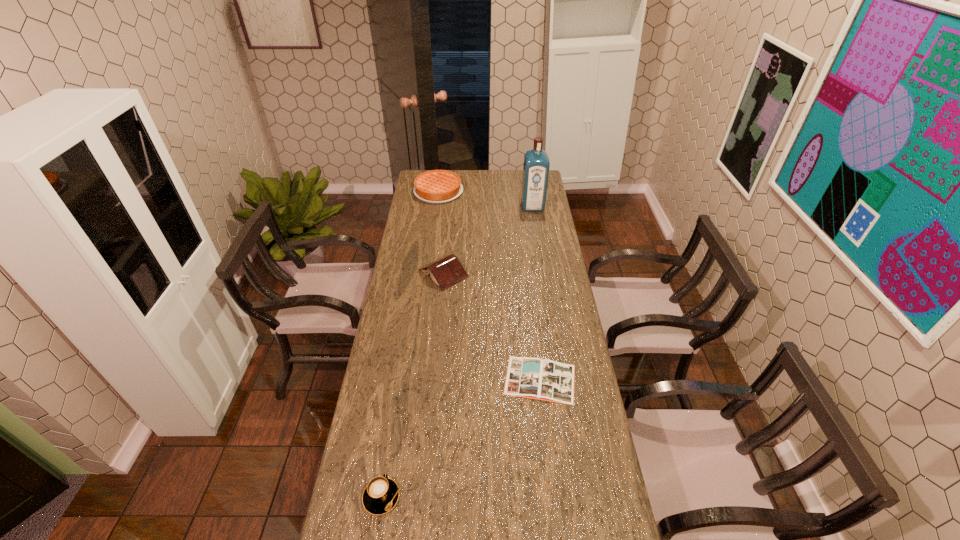
Where is `vacant position located 0.130m on the back of the fifth farthest object`? vacant position located 0.130m on the back of the fifth farthest object is located at coordinates (392, 436).

Find the location of a particular element. vacant space situated on the left of the shortest book is located at coordinates (398, 380).

This screenshot has height=540, width=960. I want to click on object positioned at the far edge, so click(436, 186).

Find the location of a particular element. This screenshot has width=960, height=540. pie at the left edge is located at coordinates (436, 186).

Locate an element on the screen. The width and height of the screenshot is (960, 540). book that is at the left edge is located at coordinates (446, 271).

This screenshot has width=960, height=540. Identify the location of cappuccino present at the left edge. (380, 496).

Locate an element on the screen. The image size is (960, 540). liquor located in the right edge section of the desktop is located at coordinates (536, 166).

This screenshot has width=960, height=540. I want to click on book that is positioned at the right edge, so click(x=548, y=380).

You are a GUI agent. You are given a task and a screenshot of the screen. Output one action in this format:
    pyautogui.click(x=<x>, y=<y>)
    Task: Click on the object that is at the far left corner
    
    Given the screenshot: What is the action you would take?
    pyautogui.click(x=436, y=186)

Locate an element on the screen. The height and width of the screenshot is (540, 960). vacant space at the far edge is located at coordinates (516, 176).